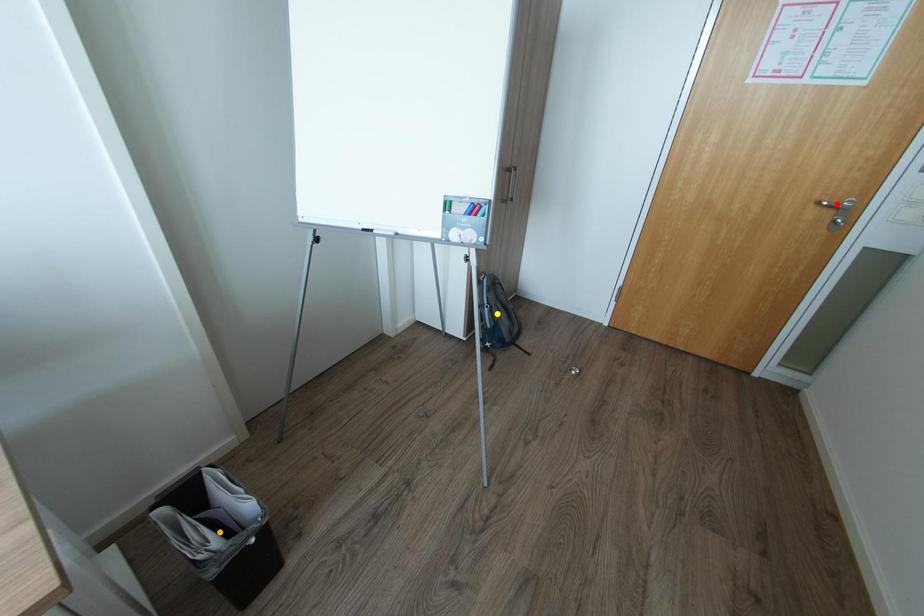
Order these from nearest to farthest:
red point, yellow point, orange point

yellow point, red point, orange point